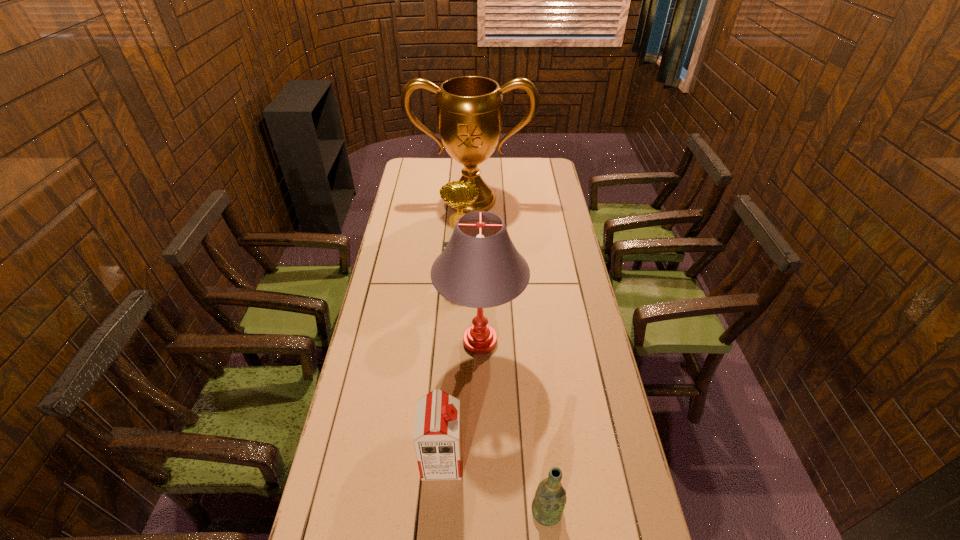
You are a GUI agent. You are given a task and a screenshot of the screen. Output one action in this format:
    pyautogui.click(x=<x>, y=<y>)
    Task: Click on the trophy cup
    
    Given the screenshot: What is the action you would take?
    click(x=469, y=108)

Image resolution: width=960 pixels, height=540 pixels. I want to click on the fourth shortest object, so click(480, 267).

You are a GUI agent. You are given a task and a screenshot of the screen. Output one action in this format:
    pyautogui.click(x=<x>, y=<y>)
    Task: Click on the table lamp
    This screenshot has width=960, height=540.
    Given the screenshot: What is the action you would take?
    pyautogui.click(x=480, y=267)

This screenshot has width=960, height=540. Identify the location of award. (459, 195).

What are the coordinates of `the third tallest object` in the screenshot? It's located at (459, 195).

Identify the location of the second nearest object. This screenshot has height=540, width=960. (437, 440).

Where is `soya milk`? The width and height of the screenshot is (960, 540). soya milk is located at coordinates (437, 440).

The width and height of the screenshot is (960, 540). Identify the location of beer bottle. (548, 505).

What are the coordinates of `the nearest object` in the screenshot? It's located at (548, 505).

You are a GUI agent. You are given a task and a screenshot of the screen. Output one action in this format:
    pyautogui.click(x=<x>, y=<y>)
    Task: Click on the vacant space located on the surface of the farthest object with symbols
    The height and width of the screenshot is (540, 960).
    Given the screenshot: What is the action you would take?
    pyautogui.click(x=469, y=265)